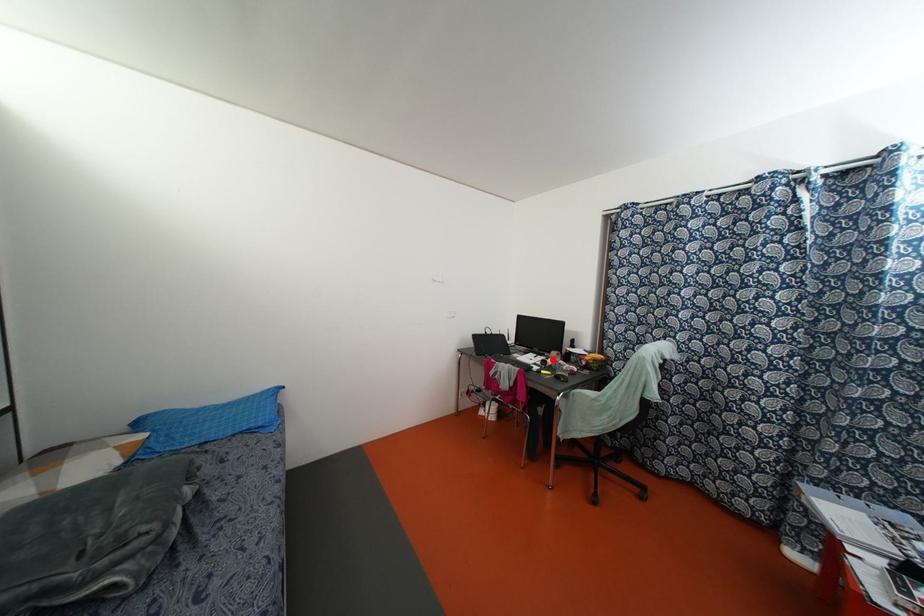
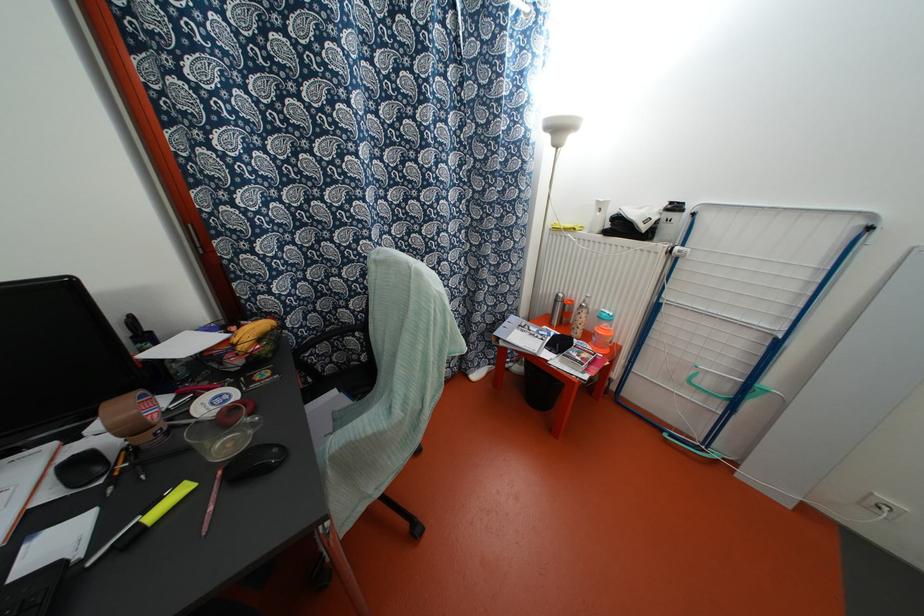
In the second image, find the point that corresponds to the highlighted location in the first image.

(131, 429)